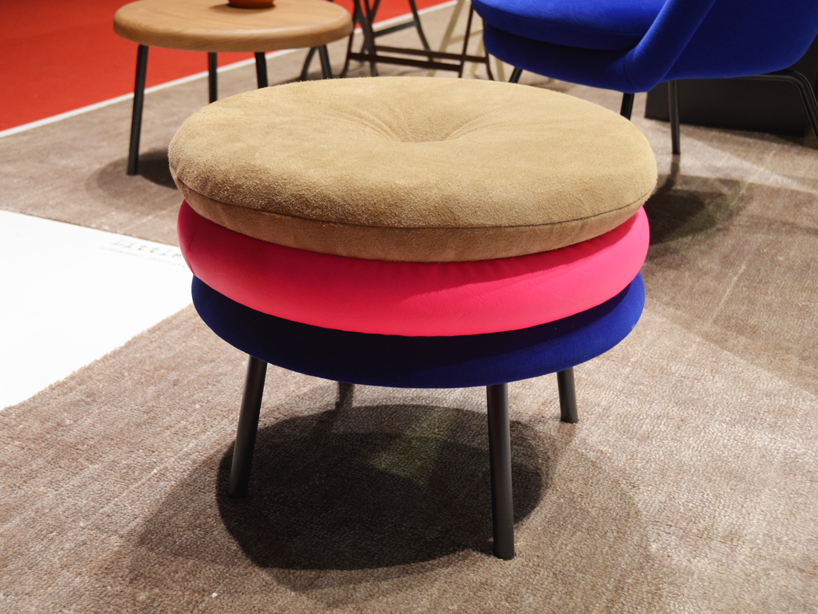
Image resolution: width=818 pixels, height=614 pixels. I want to click on seat, so click(x=454, y=363).